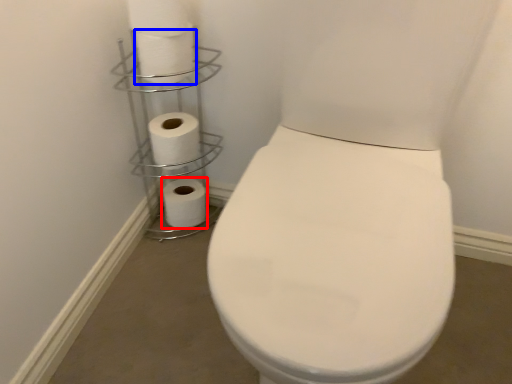
Question: Which object appears closest to the camera in this image, toilet paper (highlighted by a red box) or toilet paper (highlighted by a blue box)?

Choices:
 (A) toilet paper
 (B) toilet paper

Answer: (B)